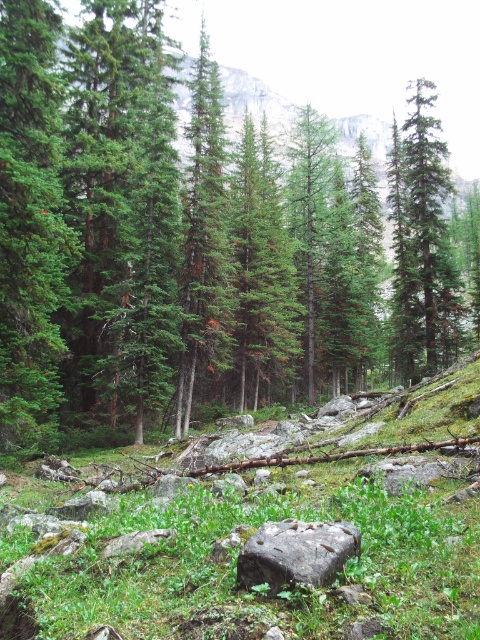
Question: Is green matte tree at center smaller than green matte tree at upper right?

Choices:
 (A) yes
 (B) no

Answer: (B)

Question: Which of the following is the farthest from the observer?

Choices:
 (A) [x=269, y=541]
 (B) [x=84, y=438]

Answer: (B)

Question: Is green matte tree at center thinner than green matte tree at upper right?

Choices:
 (A) yes
 (B) no

Answer: (B)

Question: Which point appears farthest from the camera in this image?

Choices:
 (A) (288, 371)
 (B) (436, 204)

Answer: (B)

Question: Which point is closer to the camera?

Choices:
 (A) green matte tree at center
 (B) gray rough rock at center
 (C) green matte tree at upper right

Answer: (B)

Question: Does green matte tree at center have a greater width compared to gray rough rock at center?

Choices:
 (A) no
 (B) yes

Answer: (B)